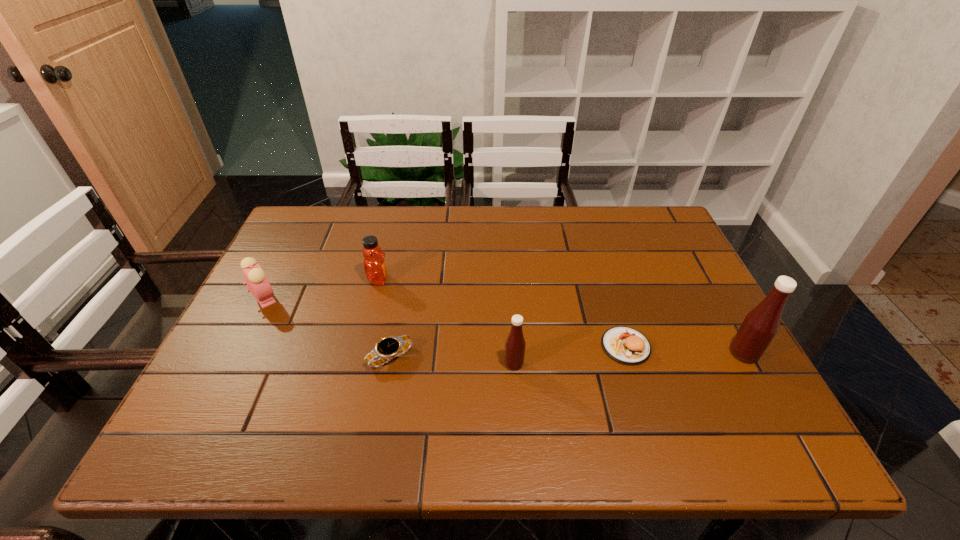
This screenshot has height=540, width=960. I want to click on free region that satisfies the following two spatial constraints: 1. on the front label of the honey; 2. on the back side of the tallest object, so click(360, 354).

You are a GUI agent. You are given a task and a screenshot of the screen. Output one action in this format:
    pyautogui.click(x=<x>, y=<y>)
    Task: Click on the free region that satisfies the following two spatial constraints: 1. on the face of the leftmost object; 2. on the left side of the taller Tabasco sauce
    Image resolution: width=960 pixels, height=540 pixels.
    Given the screenshot: What is the action you would take?
    pyautogui.click(x=236, y=354)